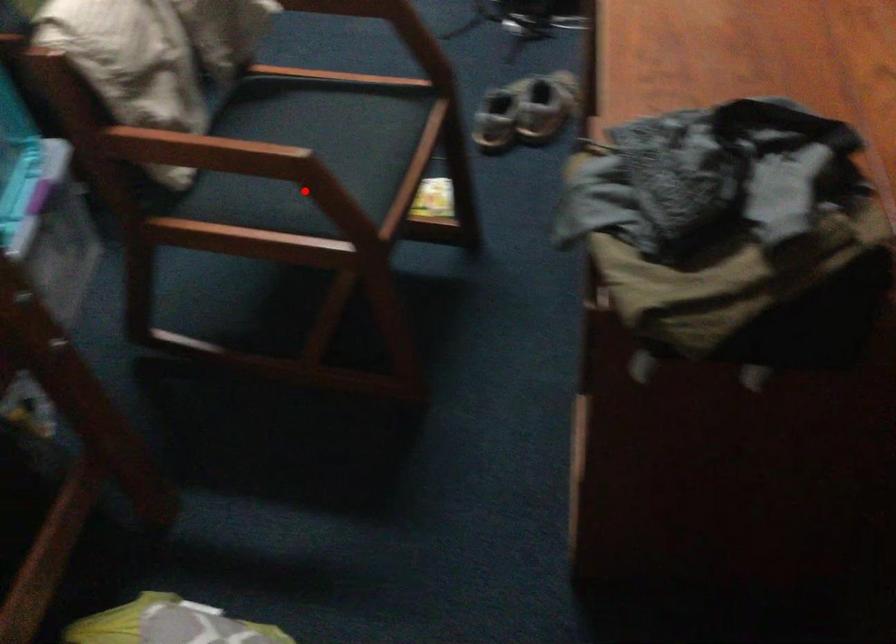
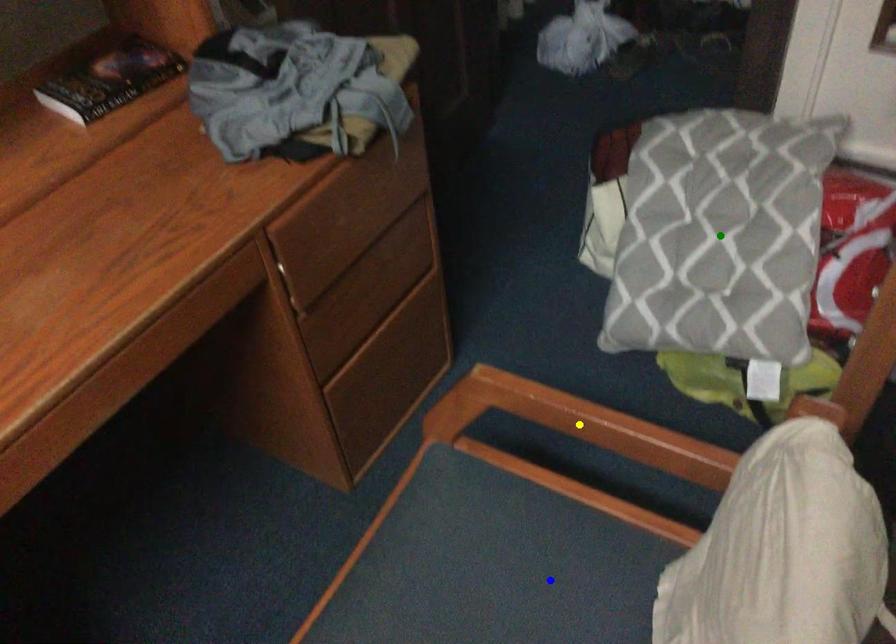
Question: I am providing you with two images of the same scene from different viewpoints. A red point is marked on the first image. You are given multiple points on the second image. Which point in image 2 is actually the same real-world point as the red point in image 1?

Choices:
 (A) green point
 (B) blue point
 (C) yellow point

Answer: (B)